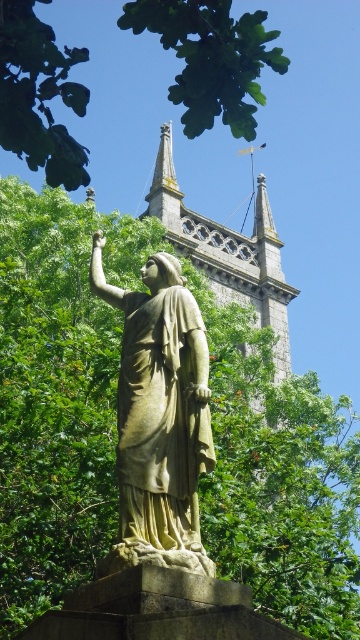
Question: Does green leafy tree at center appear on the right side of stone statue at center?

Choices:
 (A) yes
 (B) no

Answer: (A)

Question: Estimate the real-world distances between objects in this image. Which object is farther from the stone statue at center?

Choices:
 (A) green leafy tree at upper center
 (B) green leafy tree at center

Answer: (B)

Question: Which of the following is the closest to the observer?

Choices:
 (A) stone statue at center
 (B) green leafy tree at center
 (C) green leafy tree at upper center

Answer: (C)

Question: Is stone statue at center to the right of green leafy tree at upper center from the viewer's perspective?

Choices:
 (A) yes
 (B) no

Answer: (A)

Question: Can you confirm if stone statue at center is positioned above green leafy tree at upper center?

Choices:
 (A) yes
 (B) no

Answer: (B)

Question: Among these points, which one is nearest to the camera?

Choices:
 (A) (123, 422)
 (B) (15, 422)

Answer: (A)